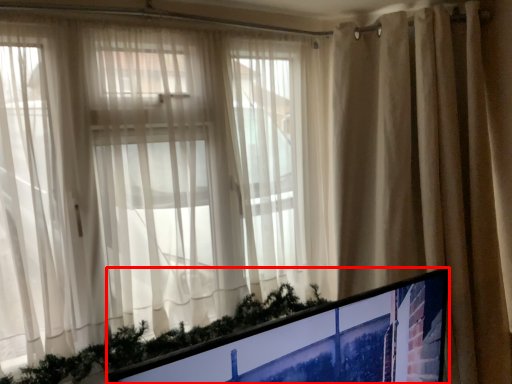
Question: From the image's perspective, where is computer monitor (annotated by the red box) located in relation to curtain in the image?

Choices:
 (A) below
 (B) above

Answer: (A)